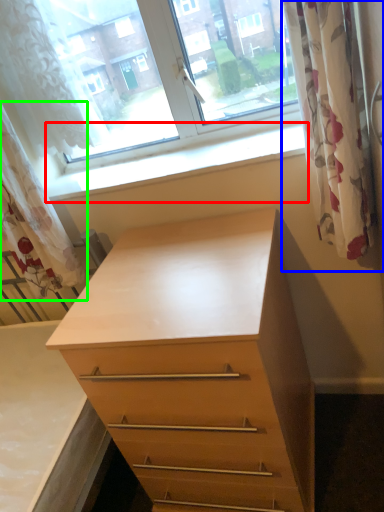
Question: Estimate the real-world distances between objects in this image. Which object is closer to window sill (highlighted by a red box), curtain (highlighted by a blue box) or curtain (highlighted by a green box)?

Choices:
 (A) curtain
 (B) curtain

Answer: (B)